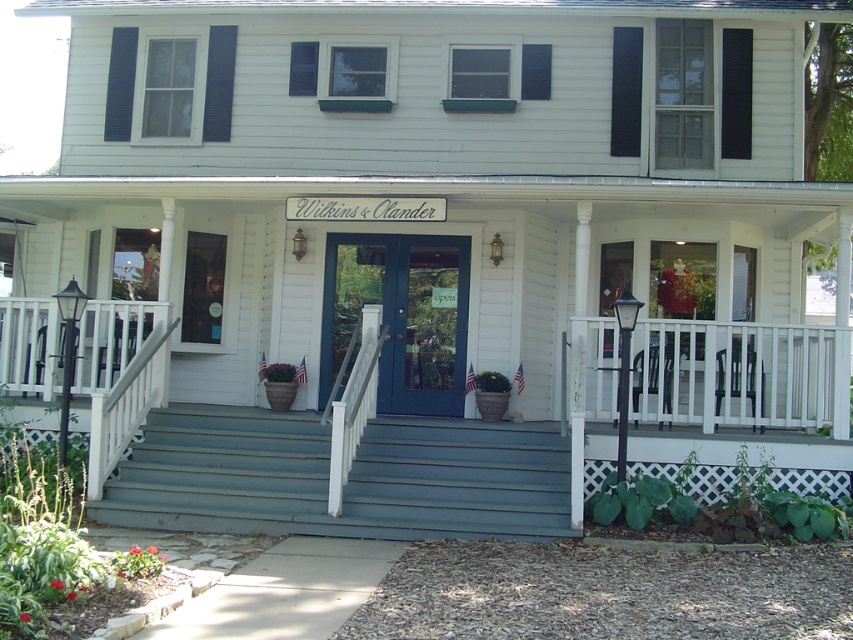
You are standing on the teal painted wood stairs at center and want to enter the house through the front door. Which direction should you move relative to the white wooden porch at center?

You should move forward towards the white wooden porch at center because the teal painted wood stairs at center is behind the white wooden porch at center, so moving forward towards it will lead you to the entrance.

You are standing at the entrance of the house and want to walk towards the point labeled point (x=549, y=211). Which direction should you move relative to point (x=373, y=518)?

Since point (x=549, y=211) is behind point (x=373, y=518), you should move backward away from point (x=373, y=518) to reach point (x=549, y=211).

You are a painter hired to paint the white wooden porch at center and the teal painted wood stairs at center. You need to know which one is higher so you can decide where to set up your ladder first. Based on the scene description, which object is taller?

The white wooden porch at center is taller than the teal painted wood stairs at center according to the description.